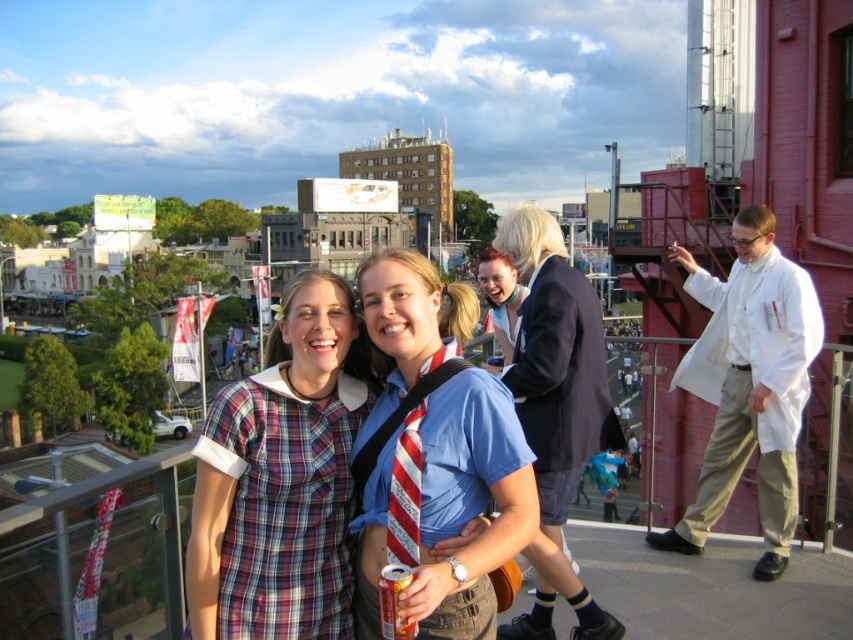
Question: Which point appears closest to the camera in this image?

Choices:
 (A) (202, 451)
 (B) (408, 440)
 (C) (415, 509)

Answer: (A)

Question: Which point is closer to the camera?

Choices:
 (A) white lab coat at right
 (B) blonde hair at center
 (C) red striped tie at center
 (D) plaid fabric dress at center

Answer: (D)

Question: Is plaid fabric dress at center wider than white lab coat at right?

Choices:
 (A) no
 (B) yes

Answer: (B)

Question: Among these objects, which one is farthest from the camera?

Choices:
 (A) red striped tie at center
 (B) white lab coat at right
 (C) plaid fabric dress at center
 (D) blue fabric shirt at center

Answer: (B)

Question: Is plaid fabric dress at center wider than blue fabric shirt at center?

Choices:
 (A) no
 (B) yes

Answer: (B)

Question: Is plaid fabric dress at center thinner than blonde hair at center?

Choices:
 (A) yes
 (B) no

Answer: (B)